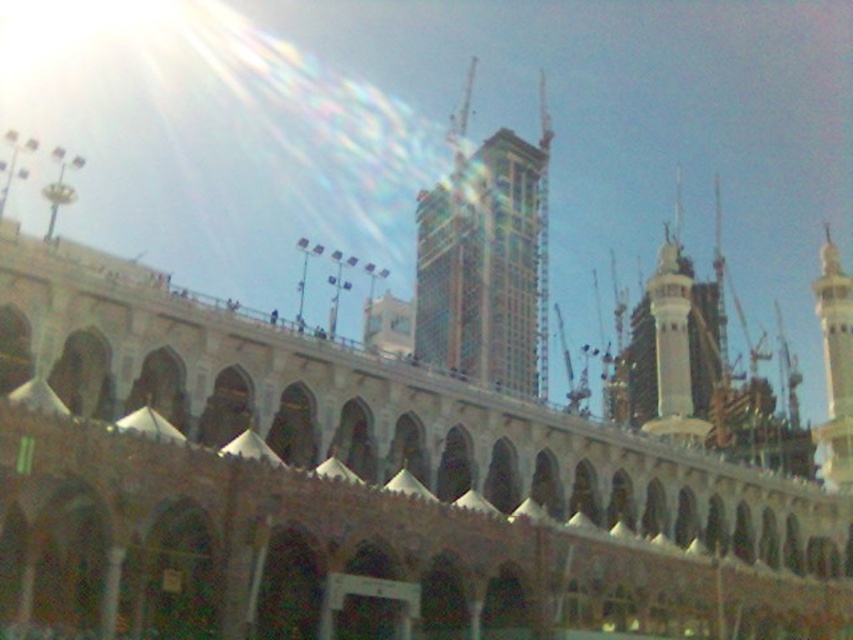
Question: Does green mosaic tower at center lie in front of white glossy minaret at right?

Choices:
 (A) yes
 (B) no

Answer: (B)

Question: In this image, where is green mosaic tower at center located relative to white glossy minaret at right?

Choices:
 (A) above
 (B) below

Answer: (A)

Question: Which object appears closest to the camera in this image?

Choices:
 (A) green mosaic tower at center
 (B) white glossy minaret at right

Answer: (B)

Question: Is green mosaic tower at center to the left of white glossy minaret at right from the viewer's perspective?

Choices:
 (A) yes
 (B) no

Answer: (A)

Question: Which of the following is the farthest from the observer?

Choices:
 (A) green mosaic tower at center
 (B) white glossy minaret at right

Answer: (A)